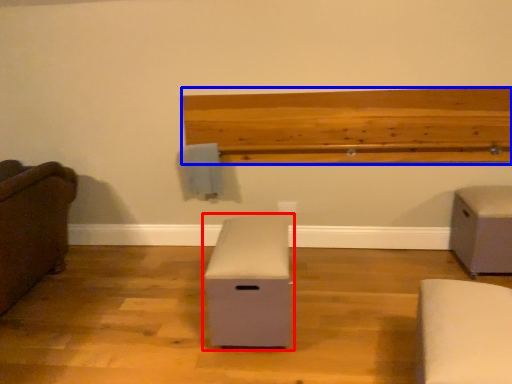
Question: Among these objects, which one is nearest to the camera, furniture (highlighted by a red box) or ledge (highlighted by a blue box)?

Choices:
 (A) furniture
 (B) ledge

Answer: (A)